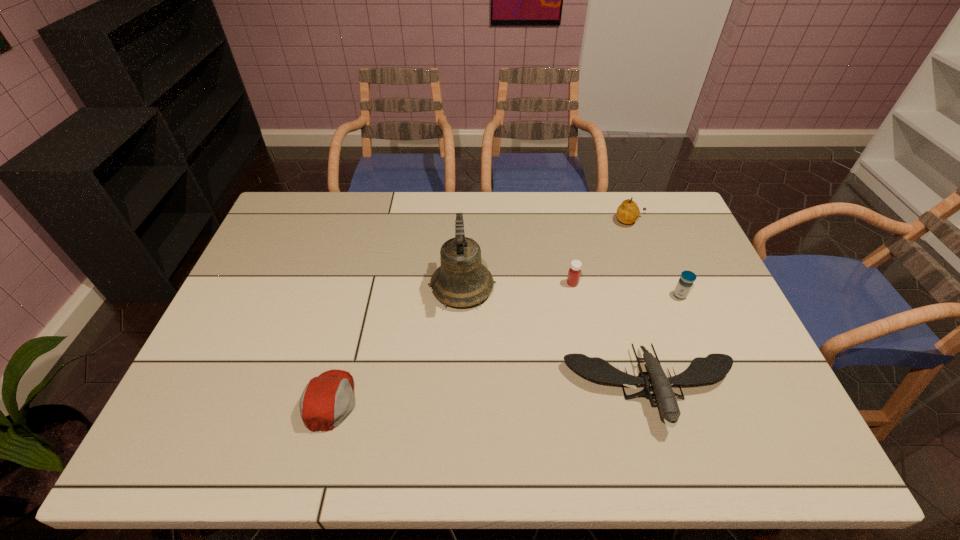
Image resolution: width=960 pixels, height=540 pixels. I want to click on empty space between the fifth shortest object and the drone, so click(640, 305).

The image size is (960, 540). Identify the location of vacant space that's between the left medicine and the right medicine. (626, 289).

Locate an element on the screen. The height and width of the screenshot is (540, 960). free space between the farther medicine and the cap is located at coordinates (451, 342).

Image resolution: width=960 pixels, height=540 pixels. I want to click on vacant space that's between the fifth object from right to left and the cap, so click(396, 344).

I want to click on free space between the bell and the drone, so click(557, 338).

Image resolution: width=960 pixels, height=540 pixels. Identify the location of object that is the fifth closest to the fifth object from right to left. (685, 283).

Locate an element on the screen. This screenshot has width=960, height=540. the fifth closest object to the drone is located at coordinates (328, 399).

This screenshot has height=540, width=960. Find the location of `free space that satisfies the following two spatial constraints: 1. on the front side of the farther medicine; 2. on the right side of the right medicine`. free space that satisfies the following two spatial constraints: 1. on the front side of the farther medicine; 2. on the right side of the right medicine is located at coordinates (575, 295).